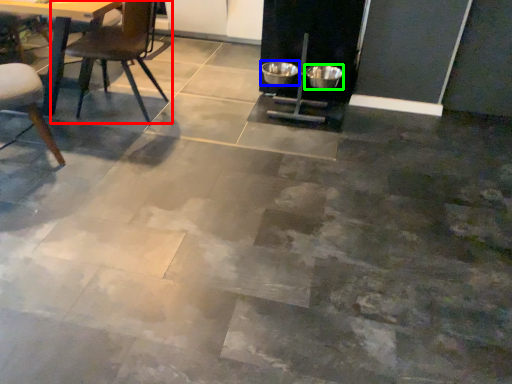
Question: Based on their relative distances, which object is farther from chair (highlighted by a red box)? Choose from bowl (highlighted by a blue box) and bowl (highlighted by a green box).

Choices:
 (A) bowl
 (B) bowl

Answer: (B)